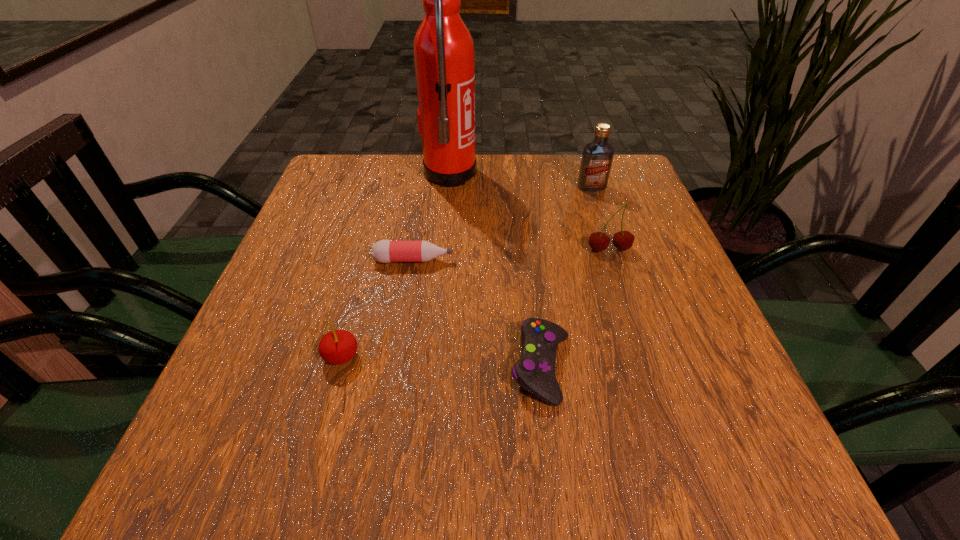
I want to click on fire extinguisher, so click(x=444, y=56).

Find the location of a particular element. vodka is located at coordinates (597, 157).

You are a GUI agent. You are given a task and a screenshot of the screen. Output one action in this format:
    pyautogui.click(x=<x>, y=<y>)
    Task: Click on the right cherry
    
    Given the screenshot: What is the action you would take?
    pyautogui.click(x=623, y=240)

You are a GUI agent. You are given a task and a screenshot of the screen. Output one action in this format:
    pyautogui.click(x=<x>, y=<y>)
    Task: Click on the nearer cherry
    This screenshot has height=540, width=960.
    Given the screenshot: What is the action you would take?
    pyautogui.click(x=337, y=347)

Identify the location of the third object from right to left. (535, 370).

The height and width of the screenshot is (540, 960). I want to click on bottle, so click(385, 251).

I want to click on free location located on the label side of the tallest object, so click(x=553, y=174).

Find the location of a particular element. This screenshot has width=960, height=540. vacant space situated 0.080m on the front-facing side of the second tallest object is located at coordinates (600, 211).

This screenshot has height=540, width=960. Identify the location of free location located on the surface of the right cherry. (636, 335).

Where is `vacant space located on the front of the nearer cherry`? This screenshot has height=540, width=960. vacant space located on the front of the nearer cherry is located at coordinates (327, 410).